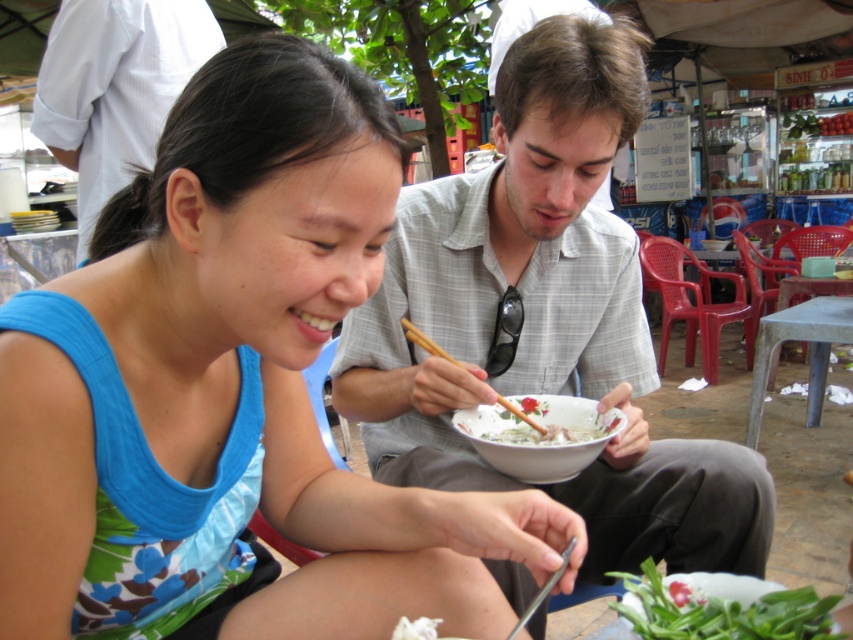
Can you confirm if white glossy bowl at center is smaller than wooden chopsticks at upper center?

Correct, white glossy bowl at center occupies less space than wooden chopsticks at upper center.

This screenshot has height=640, width=853. Find the location of `white glossy bowl at center`. white glossy bowl at center is located at coordinates (538, 435).

Locate an element on the screen. The width and height of the screenshot is (853, 640). white glossy bowl at center is located at coordinates (538, 435).

Is blue fabric tank top at center above green leafy vegetables at lower right?

Correct, blue fabric tank top at center is located above green leafy vegetables at lower right.

Where is `blue fabric tank top at center`? This screenshot has height=640, width=853. blue fabric tank top at center is located at coordinates 236,385.

Identify the location of blue fabric tank top at center. The image size is (853, 640). (236, 385).

Does blue fabric tank top at center appear on the right side of white glossy bowl at center?

Incorrect, blue fabric tank top at center is not on the right side of white glossy bowl at center.

Is point (82, 616) closer to camera compared to point (538, 444)?

Yes, it is in front of point (538, 444).

This screenshot has width=853, height=640. What are the coordinates of `blue fabric tank top at center` in the screenshot? It's located at (236, 385).